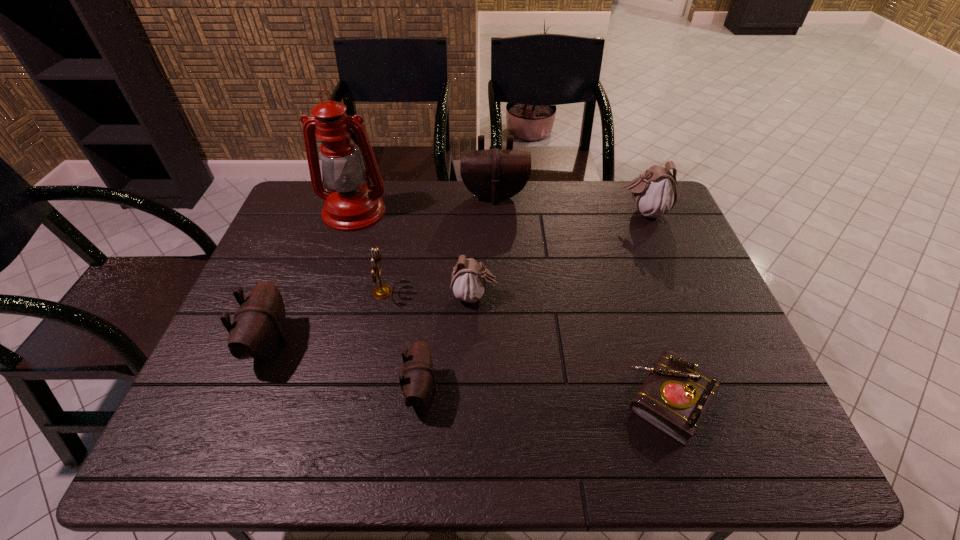
The height and width of the screenshot is (540, 960). I want to click on the smaller white pouch, so click(469, 280).

Locate an element on the screen. the second brown pouch from right to left is located at coordinates (418, 376).

Where is `the smallest brown pouch`? the smallest brown pouch is located at coordinates (418, 376).

The height and width of the screenshot is (540, 960). Identify the location of the shortest object. (674, 397).

Identify the location of vacant region located 0.120m on the front of the tallest object. The image size is (960, 540). tap(339, 258).

This screenshot has height=540, width=960. Identify the location of vacant area situated 0.340m with the flap open on the biggest brown pouch. (498, 281).

Image resolution: width=960 pixels, height=540 pixels. What are the coordinates of `vacant space located on the front-facing side of the right white pouch` in the screenshot? It's located at (596, 212).

This screenshot has height=540, width=960. I want to click on vacant region located 0.060m on the front-facing side of the right white pouch, so click(x=600, y=212).

I want to click on free point located 0.050m on the front-facing side of the right white pouch, so click(603, 212).

The width and height of the screenshot is (960, 540). I want to click on free region located on the left of the gold candelabrum, so click(295, 292).